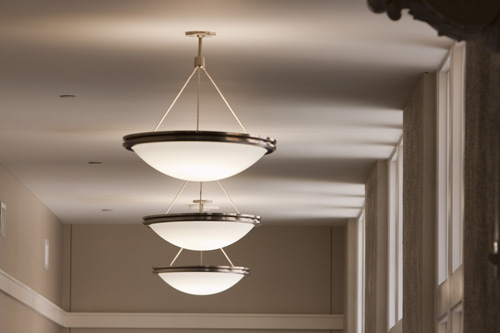
Find the location of `shadows on ceiling`. shadows on ceiling is located at coordinates (363, 88), (360, 173).